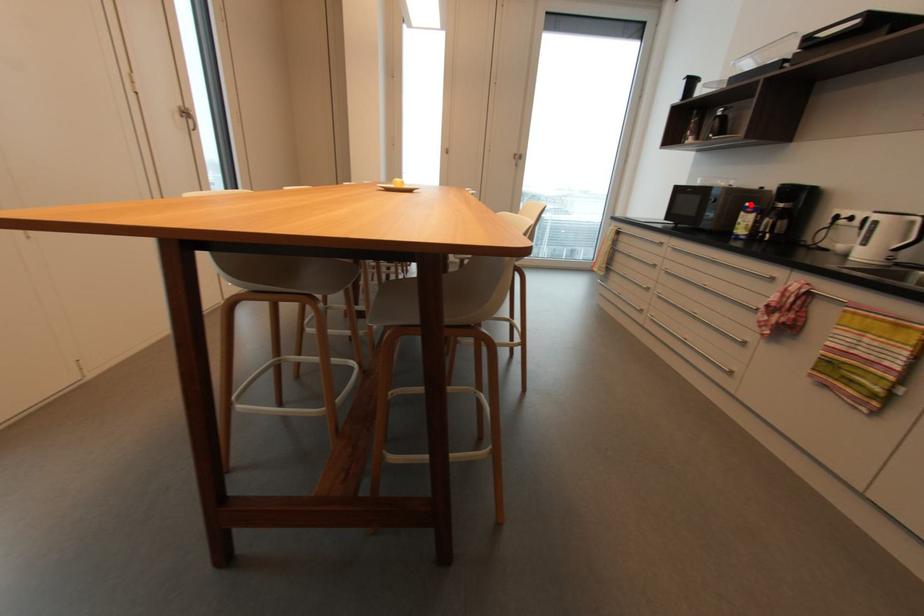
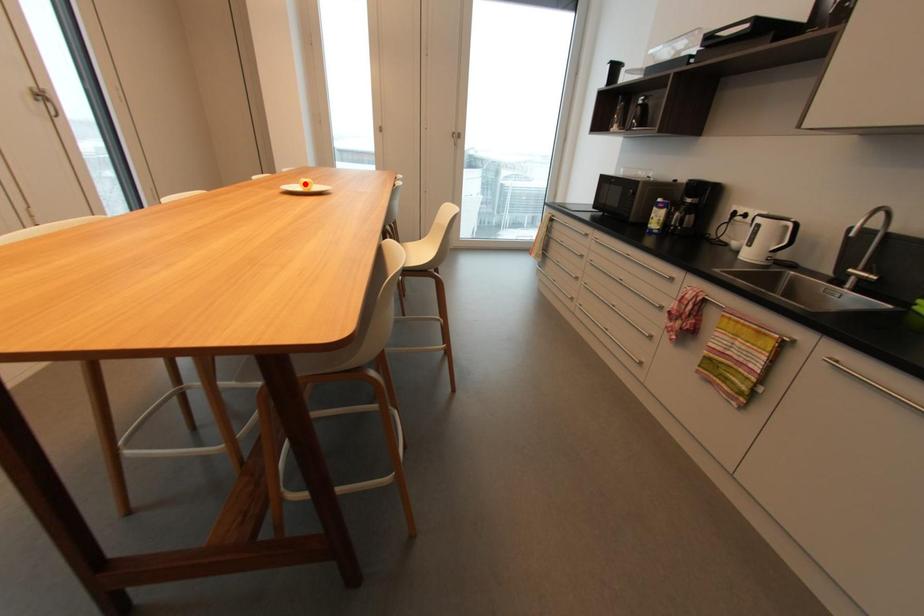
I am providing you with two images of the same scene from different viewpoints. A red point is marked on the first image and another point is marked on the second image. Is the marked point in image1 the same physical position as the marked point in image2?

No